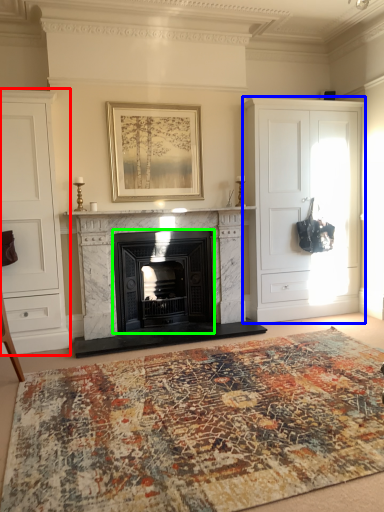
Question: Estimate the real-world distances between objects in this image. Which object is farther from cabinetry (highlighted by a red box), cabinetry (highlighted by a blue box) or wood burning stove (highlighted by a green box)?

Choices:
 (A) cabinetry
 (B) wood burning stove

Answer: (A)